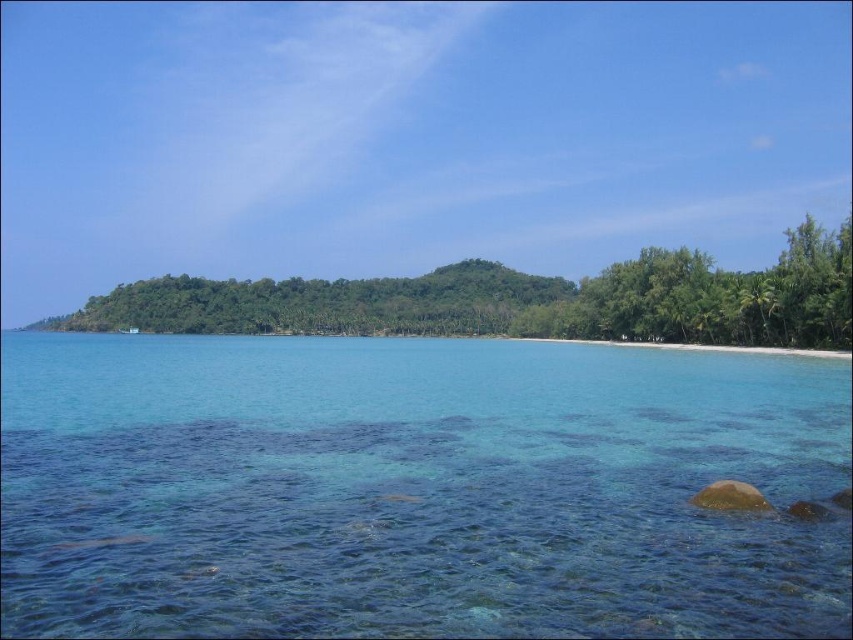
Who is positioned more to the right, clear blue water at center or green leafy trees at center?

clear blue water at center

Is clear blue water at center taller than green leafy trees at center?

No, clear blue water at center is not taller than green leafy trees at center.

Does point (234, 429) come farther from viewer compared to point (527, 323)?

That is False.

Where is `clear blue water at center`? clear blue water at center is located at coordinates (415, 488).